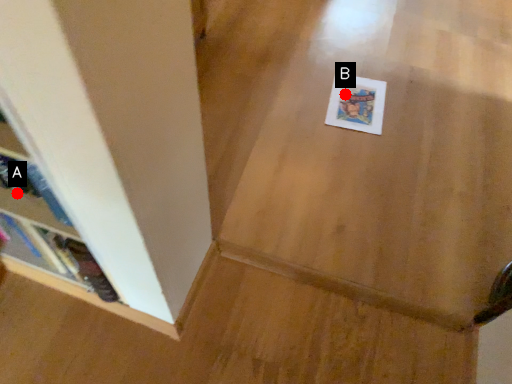
Question: Two points are circled on the image, labeled by A and B beside each circle. Which point is closer to the camera?

Choices:
 (A) A is closer
 (B) B is closer

Answer: (A)